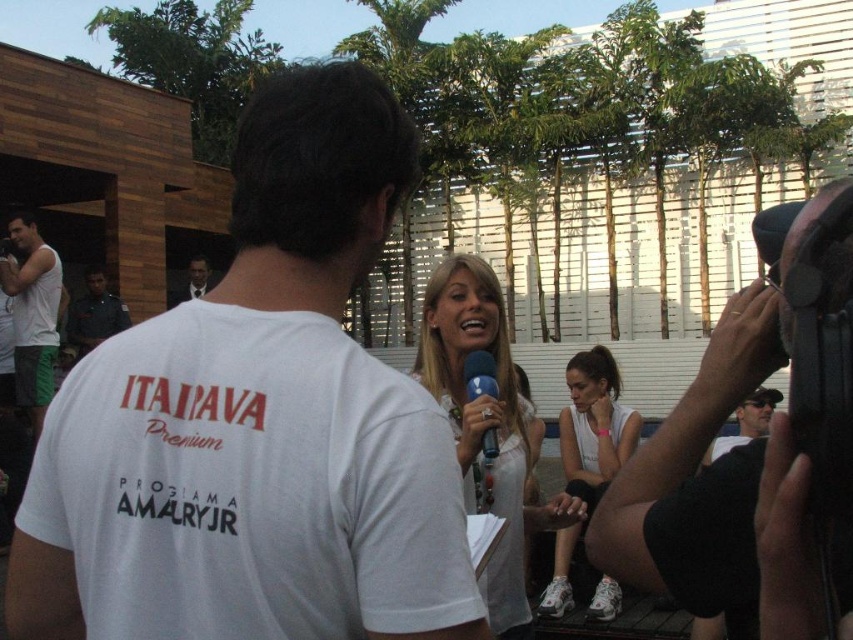
Question: Does black matte camera at upper right have a lesser width compared to matte white dress at center?

Choices:
 (A) yes
 (B) no

Answer: (B)

Question: Is matte white dress at center to the right of white cotton tank top at left from the viewer's perspective?

Choices:
 (A) yes
 (B) no

Answer: (A)

Question: Which point is farther to the camera?

Choices:
 (A) dark gray baseball cap at upper right
 (B) white cotton tank top at left
 (C) white fabric tank top at lower center
 (D) black plastic microphone at center

Answer: (B)

Question: Is white fabric tank top at lower center smaller than black plastic microphone at center?

Choices:
 (A) yes
 (B) no

Answer: (A)

Question: Which point is closer to the camera taking this photo?

Choices:
 (A) (767, 390)
 (B) (36, 336)
 (C) (726, 456)

Answer: (C)

Question: Which object appears farthest from the camera in this image?

Choices:
 (A) white cotton tank top at left
 (B) dark green uniform at left
 (C) black matte camera at upper right

Answer: (B)